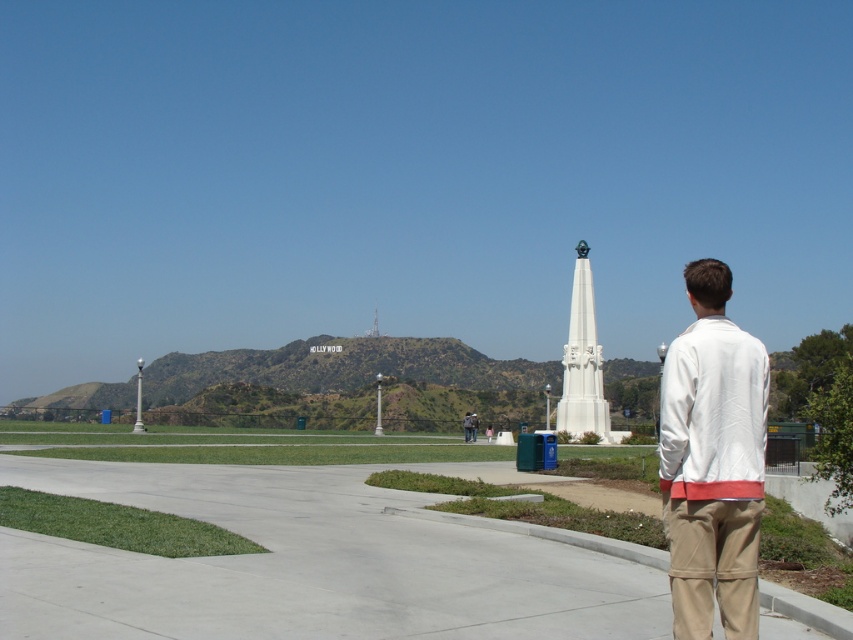
You are standing at the point with coordinates point (602, 410) and want to walk towards the Hollywood Sign. There is another point at point (693, 460). Which direction should you walk to get closer to the Hollywood Sign?

You should walk towards point (693, 460) because it is in front of point (602, 410), meaning it is closer to the Hollywood Sign.